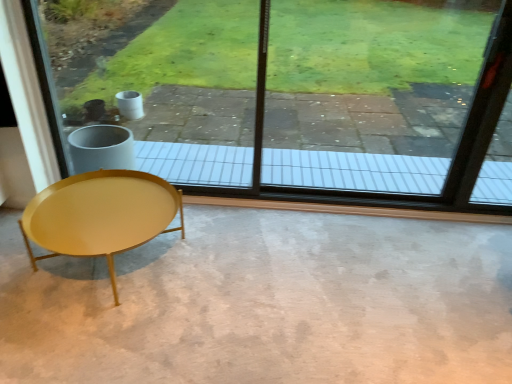
Question: Can shiny gold coffee table at lower left be found inside transparent glass window at center?

Choices:
 (A) no
 (B) yes

Answer: (A)

Question: Can you confirm if transparent glass window at center is positioned to the right of shiny gold coffee table at lower left?

Choices:
 (A) yes
 (B) no

Answer: (A)

Question: Is transparent glass window at center bigger than shiny gold coffee table at lower left?

Choices:
 (A) yes
 (B) no

Answer: (A)

Question: Can you see transparent glass window at center touching shiny gold coffee table at lower left?

Choices:
 (A) yes
 (B) no

Answer: (B)

Question: Is transparent glass window at center positioned with its back to shiny gold coffee table at lower left?

Choices:
 (A) yes
 (B) no

Answer: (B)

Question: Can you confirm if transparent glass window at center is shorter than shiny gold coffee table at lower left?

Choices:
 (A) yes
 (B) no

Answer: (B)

Question: From a real-world perspective, does shiny gold coffee table at lower left stand above transparent glass window at center?

Choices:
 (A) no
 (B) yes

Answer: (A)

Question: From the image's perspective, is shiny gold coffee table at lower left over transparent glass window at center?

Choices:
 (A) yes
 (B) no

Answer: (B)

Question: Is shiny gold coffee table at lower left facing away from transparent glass window at center?

Choices:
 (A) no
 (B) yes

Answer: (B)

Question: Does shiny gold coffee table at lower left have a smaller size compared to transparent glass window at center?

Choices:
 (A) no
 (B) yes

Answer: (B)

Question: Can we say shiny gold coffee table at lower left lies outside transparent glass window at center?

Choices:
 (A) no
 (B) yes

Answer: (B)

Question: Can you confirm if shiny gold coffee table at lower left is thinner than transparent glass window at center?

Choices:
 (A) no
 (B) yes

Answer: (A)

Question: Does smooth concrete floor at center lie in front of shiny gold coffee table at lower left?

Choices:
 (A) yes
 (B) no

Answer: (A)